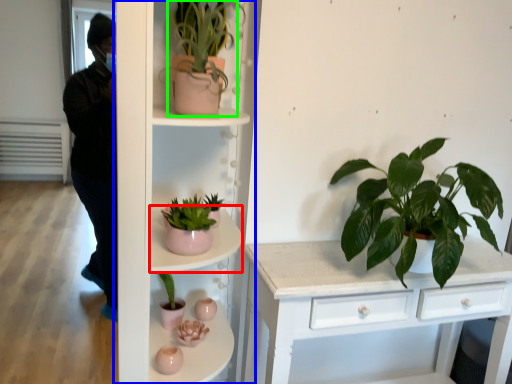
Question: Based on their relative distances, which object is farther from shelf (highlighted by a red box)? Choose from shelf (highlighted by a blue box) and houseplant (highlighted by a green box).

Choices:
 (A) shelf
 (B) houseplant

Answer: (B)